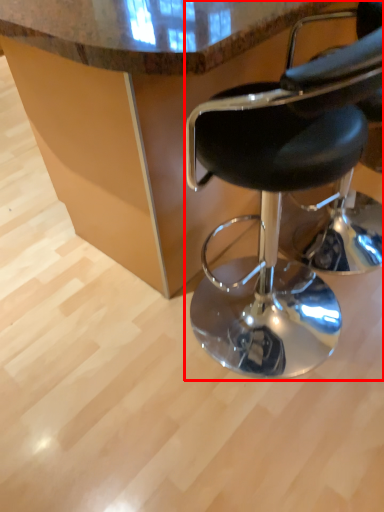
Question: From the image's perspective, where is chair (annotated by the red box) located relative to table?

Choices:
 (A) below
 (B) above

Answer: (A)